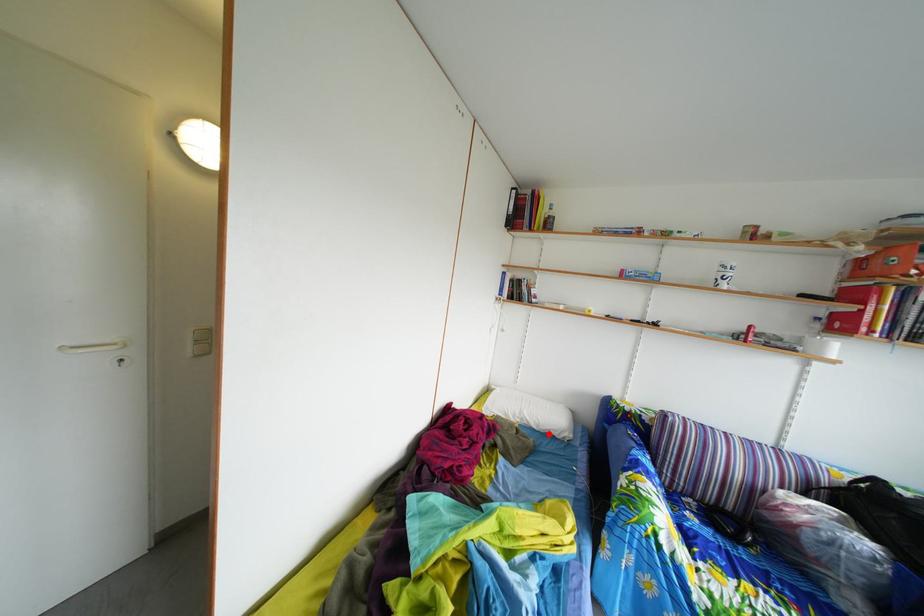
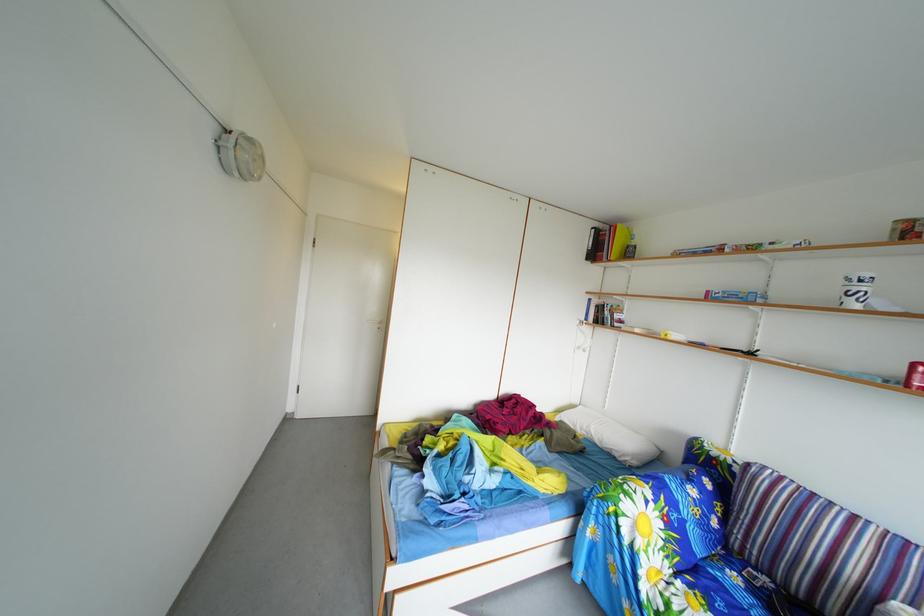
Question: I am providing you with two images of the same scene from different viewpoints. In image1, a red point is highlighted. Considering the same 3D point in image2, which of the following is correct?

Choices:
 (A) It is closer
 (B) It is farther

Answer: (B)